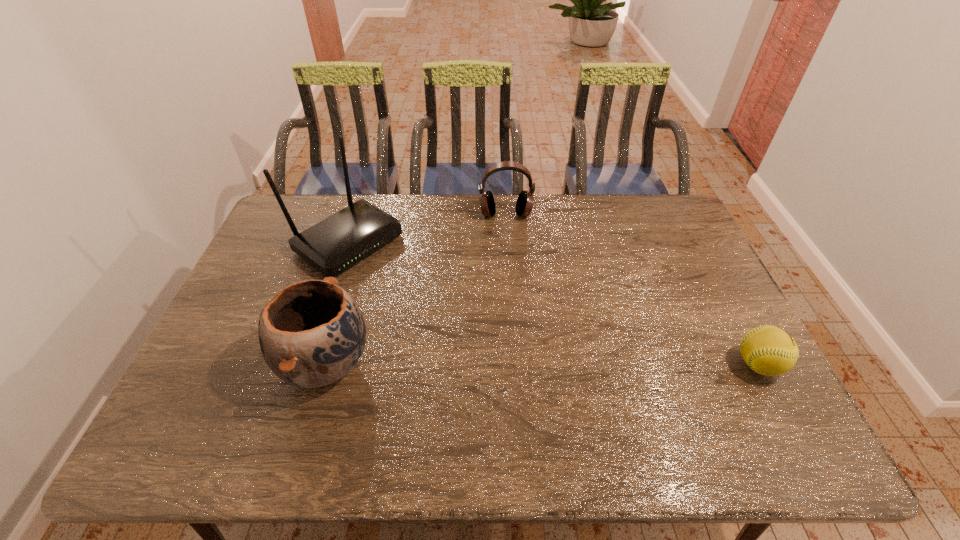
Where is `vacant space at the far edge`? vacant space at the far edge is located at coordinates (399, 195).

This screenshot has width=960, height=540. In the image, there is a desktop. What are the coordinates of `vacant space at the near edge` in the screenshot? It's located at (570, 397).

What are the coordinates of `free region at the left edge of the desktop` in the screenshot? It's located at (275, 274).

Identify the location of free space at the right edge of the desktop. This screenshot has height=540, width=960. (691, 305).

Locate an element on the screen. This screenshot has height=540, width=960. vacant space at the far left corner of the desktop is located at coordinates [x=293, y=195].

Locate an element on the screen. The width and height of the screenshot is (960, 540). free space between the headset and the router is located at coordinates (427, 228).

Identify the location of free space between the second object from right to left and the router. The image size is (960, 540). (427, 228).

Locate an element on the screen. This screenshot has height=540, width=960. free area in between the pottery and the headset is located at coordinates (416, 289).

What are the coordinates of `free spot between the rightmost object and the tallest object` in the screenshot? It's located at (553, 303).

You are a GUI agent. You are given a task and a screenshot of the screen. Output one action in this format:
    pyautogui.click(x=<x>, y=<y>)
    Task: Click on the unoccupied position between the pottery and the rightmost object
    Image resolution: width=960 pixels, height=540 pixels.
    Given the screenshot: What is the action you would take?
    pyautogui.click(x=542, y=364)